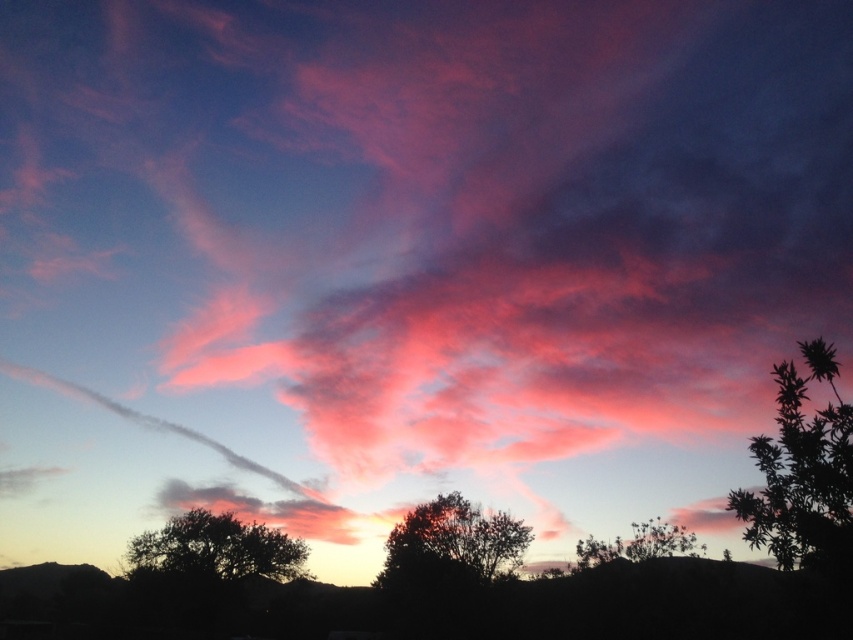
Does point (817, 525) come behind point (421, 564)?

No, (817, 525) is in front of (421, 564).

Who is more forward, (840, 433) or (405, 518)?

Point (840, 433) is more forward.

Does point (808, 532) lie in front of point (440, 508)?

Yes, point (808, 532) is closer to viewer.

Identify the location of silvery metallic tree at right. Image resolution: width=853 pixels, height=640 pixels. (802, 472).

How far apart are silhouette tree at center and silvery metallic tree at lower right?

The distance of silhouette tree at center from silvery metallic tree at lower right is 50.47 feet.

You are a GUI agent. You are given a task and a screenshot of the screen. Output one action in this format:
    pyautogui.click(x=<x>, y=<y>)
    Task: Click on the silhouette tree at center
    This screenshot has width=853, height=640.
    Given the screenshot: What is the action you would take?
    [x=453, y=541]

How much distance is there between silvery metallic tree at right and silvery metallic tree at lower right?

They are 83.64 feet apart.

Describe the element at coordinates (802, 472) in the screenshot. I see `silvery metallic tree at right` at that location.

Find the location of `silvery metallic tree at right`. silvery metallic tree at right is located at coordinates (802, 472).